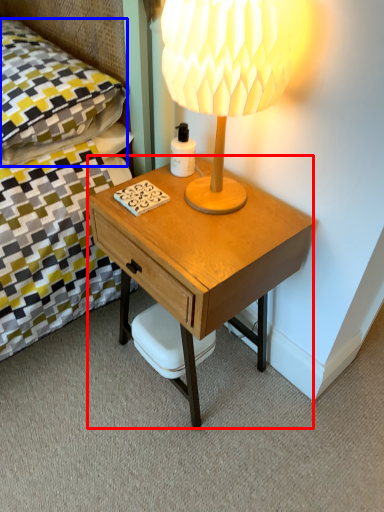
Question: Which point is further to the camera, desk (highlighted by a red box) or pillow (highlighted by a blue box)?

Choices:
 (A) desk
 (B) pillow

Answer: (B)